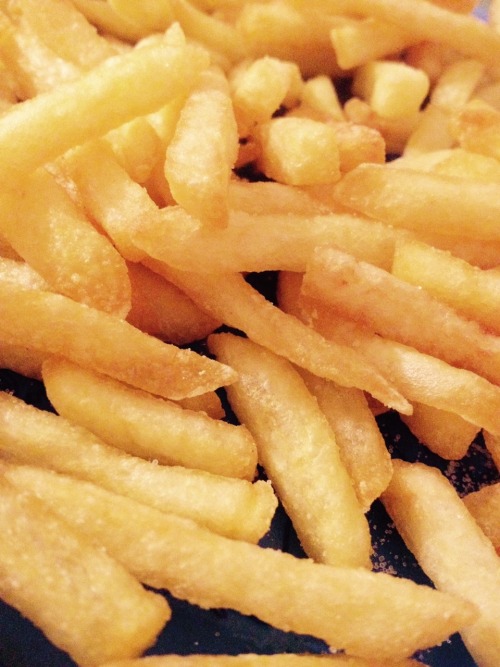
Where is `plate`? This screenshot has width=500, height=667. plate is located at coordinates (26, 385).